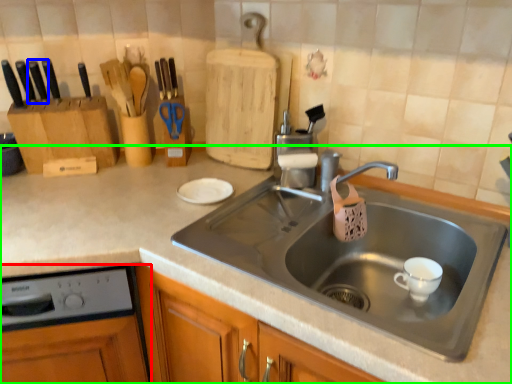
Question: Which object is the closest to the dish washer (highlighted by a red box)? Choose among these: knife (highlighted by a blue box) or countertop (highlighted by a green box).

Choices:
 (A) knife
 (B) countertop

Answer: (B)